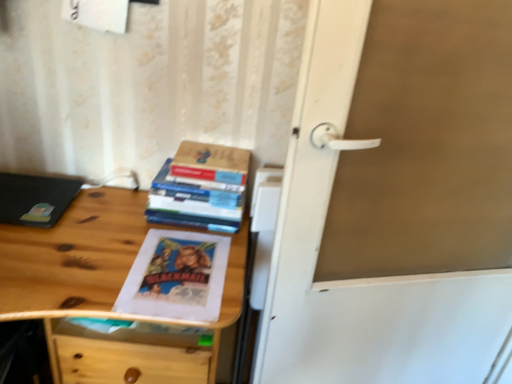
Locate an element on the screen. empty space that is ontop of hardcover books at center (from a real-world perspective) is located at coordinates (194, 181).